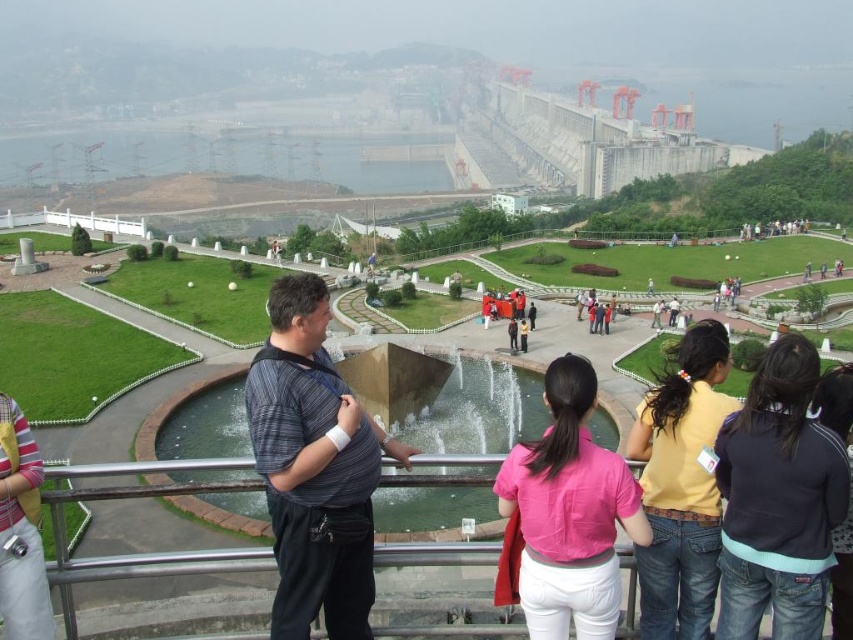
You are a photographer trying to capture a group photo of the pink fabric shirt at center and the black fleece jacket at lower right. Since you want to ensure both subjects are in focus, you need to know which one is wider. Which one has a greater width?

The pink fabric shirt at center has a greater width than the black fleece jacket at lower right according to the description.

You are standing at the viewpoint and want to locate the yellow denim jeans at lower right. According to the coordinates provided, where exactly would you find them in the image?

The yellow denim jeans at lower right are located at coordinates point (682, 486) in the image.